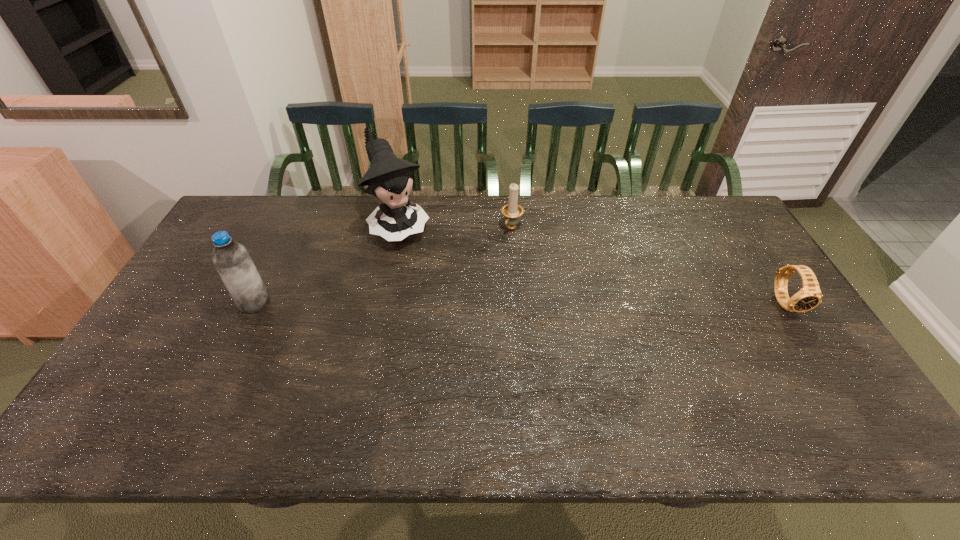
I want to click on free spot on the desktop that is between the water bottle and the rightmost object and is positioned on the handle side of the candle_holder, so click(x=462, y=302).

Locate an element on the screen. This screenshot has width=960, height=540. free space on the desktop that is between the water bottle and the rightmost object and is positioned at the face of the doll is located at coordinates (454, 302).